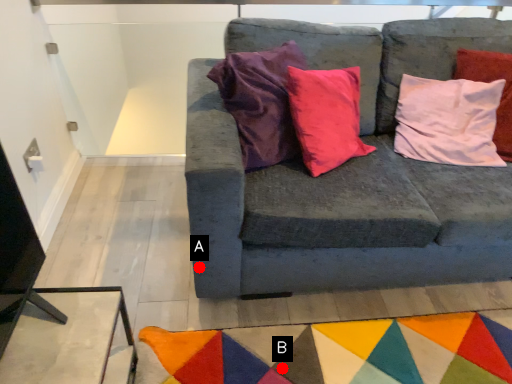
Question: Two points are circled on the image, labeled by A and B beside each circle. Which point is further to the camera?

Choices:
 (A) A is further
 (B) B is further

Answer: (A)